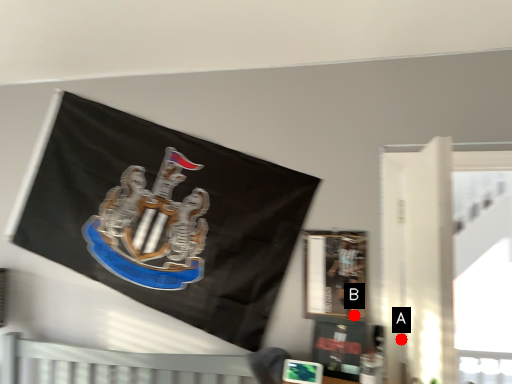
Question: Two points are circled on the image, labeled by A and B beside each circle. Among these points, which one is nearest to the camera?

Choices:
 (A) A is closer
 (B) B is closer

Answer: (A)